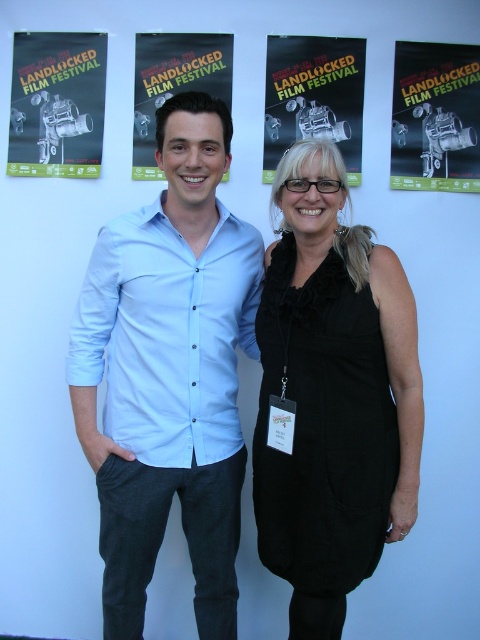
Question: Is black velvet dress at center bigger than matte paper poster at center?

Choices:
 (A) no
 (B) yes

Answer: (B)

Question: Which of the following is the closest to the observer?

Choices:
 (A) light blue button-up shirt at center
 (B) matte paper poster at center
 (C) matte black film festival poster at center

Answer: (A)

Question: Which point is closer to the camera taking this photo?

Choices:
 (A) (173, 173)
 (B) (439, 83)
 (C) (334, 428)

Answer: (C)

Question: From the image, what is the correct spatial relationship of light blue button-up shirt at center in relation to matte paper poster at center?

Choices:
 (A) above
 (B) below

Answer: (B)

Question: Which is farther from the light blue button-up shirt at center?

Choices:
 (A) matte paper camera at upper left
 (B) black velvet dress at center
 (C) matte black film camera at upper right
 (D) matte black film festival poster at center

Answer: (C)

Question: Can you confirm if black velvet dress at center is wider than matte paper poster at center?

Choices:
 (A) no
 (B) yes

Answer: (B)